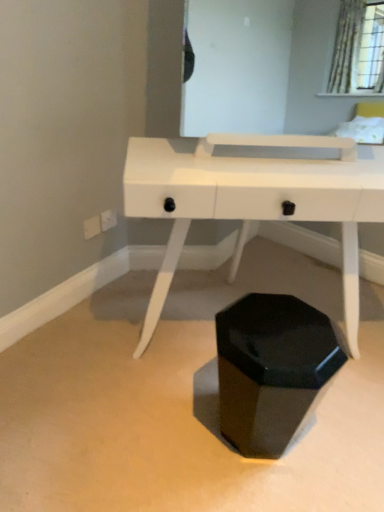
You are a GUI agent. You are given a task and a screenshot of the screen. Output one action in this format:
    pyautogui.click(x=<x>, y=<y>)
    Task: Click on the vacant region under black glossy hexagonal at center (from a real-world perspective)
    This screenshot has width=384, height=512.
    Given the screenshot: What is the action you would take?
    pyautogui.click(x=262, y=435)